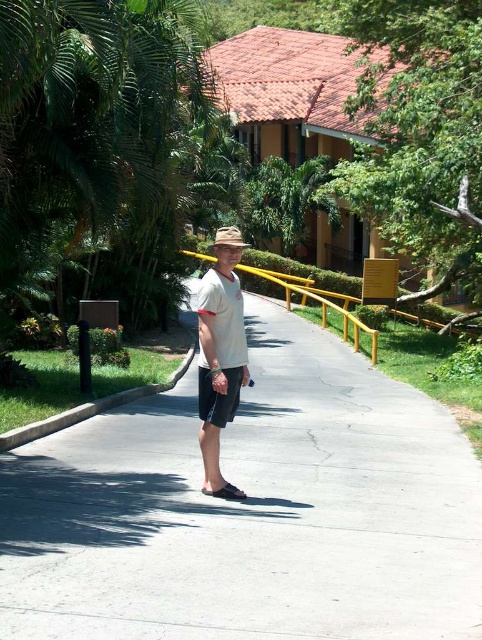
Is white concrete pavement at center further to the viewer compared to white matte shirt at center?

No, white concrete pavement at center is closer to the viewer.

Who is positioned more to the left, white concrete pavement at center or white matte shirt at center?

white matte shirt at center

Between point (40, 586) and point (238, 241), which one is positioned in front?

Point (40, 586)

Identify the location of white concrete pavement at center. (251, 512).

Which is more to the left, white matte shirt at center or yellow metal rail at center?

Positioned to the left is white matte shirt at center.

Who is lower down, white matte shirt at center or yellow metal rail at center?

white matte shirt at center is lower down.

Which is in front, point (219, 358) or point (343, 324)?

Positioned in front is point (219, 358).

Image resolution: width=482 pixels, height=640 pixels. I want to click on white matte shirt at center, so click(x=219, y=349).

From the picture: Can you confirm if yellow metal rail at center is smaller than brown straw hat at center?

Actually, yellow metal rail at center might be larger than brown straw hat at center.

Who is positioned more to the right, yellow metal rail at center or brown straw hat at center?

yellow metal rail at center is more to the right.

Locate an element on the screen. This screenshot has height=640, width=482. yellow metal rail at center is located at coordinates (318, 301).